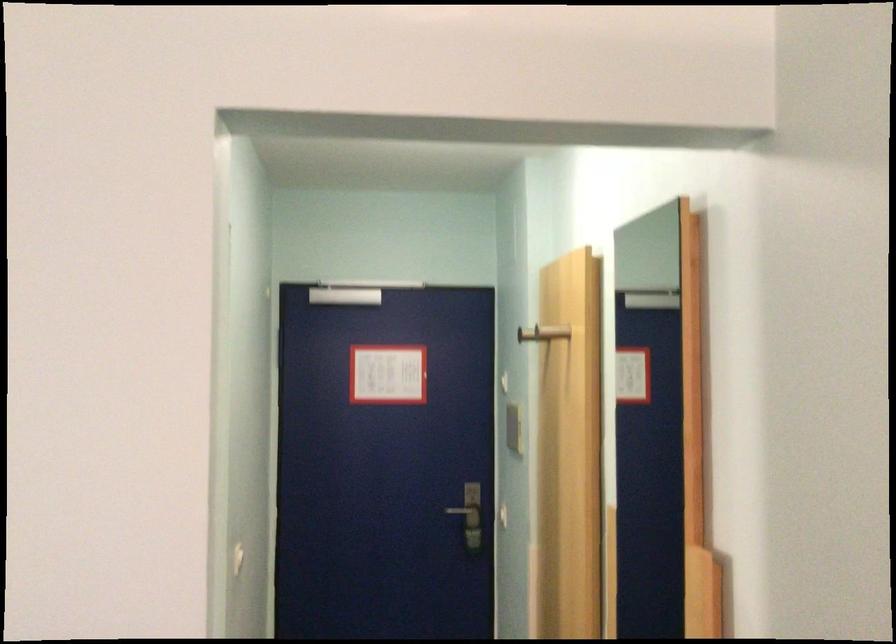
Where would you pull the silver door handle? Please return your answer as a coordinate pair (x, y).

(470, 526)